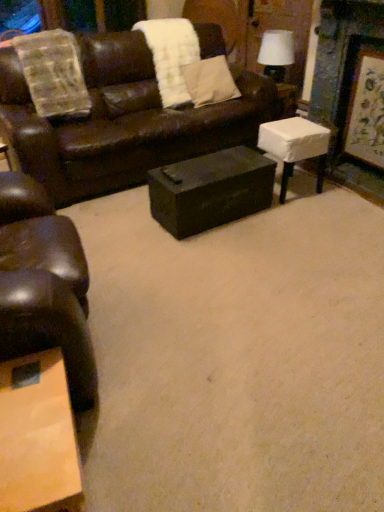
Where is `vacant area located to the right-hand side of matte black trunk at center, the second table when ordered from right to left`? This screenshot has height=512, width=384. vacant area located to the right-hand side of matte black trunk at center, the second table when ordered from right to left is located at coordinates (297, 226).